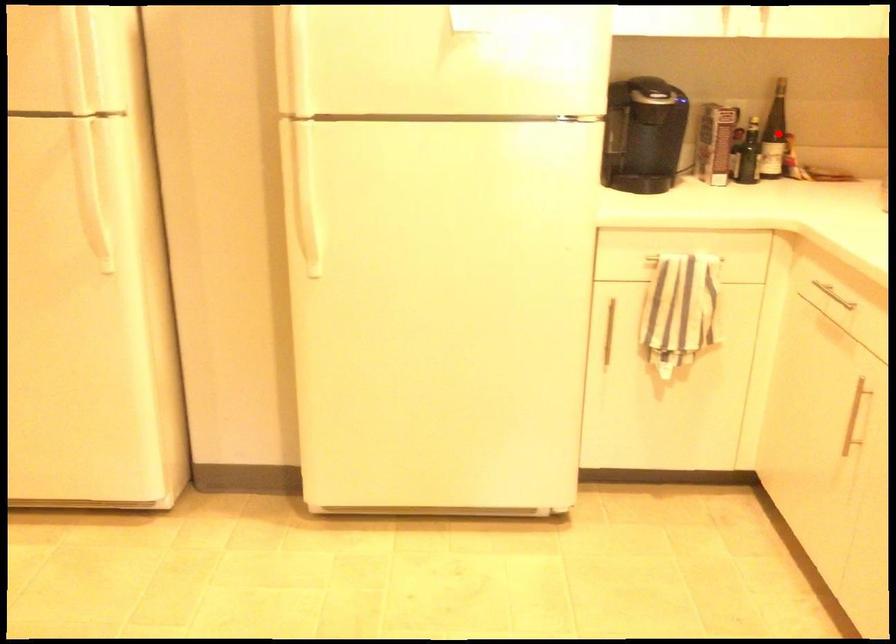
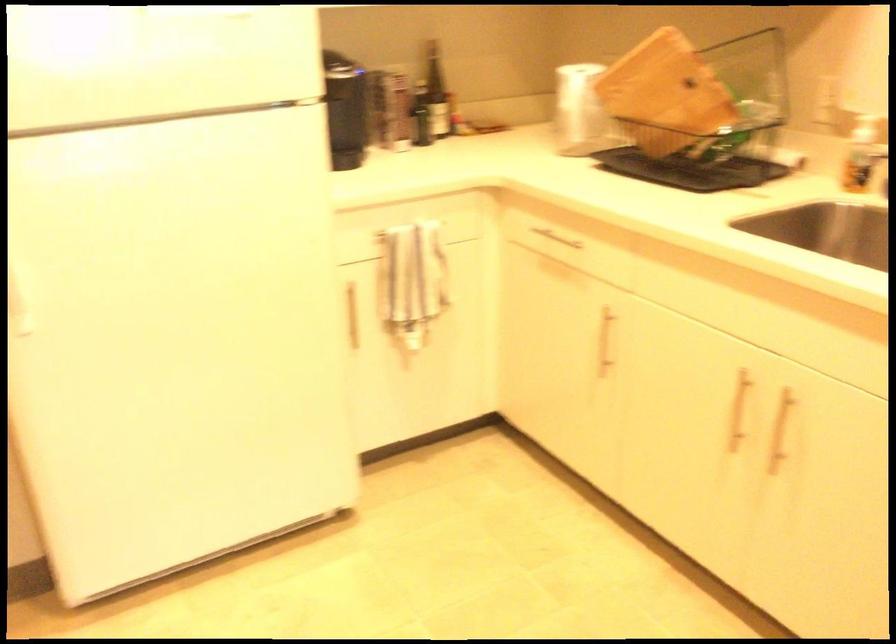
The point at the highlighted location is marked in the first image. Where is the corresponding point in the second image?

(435, 91)